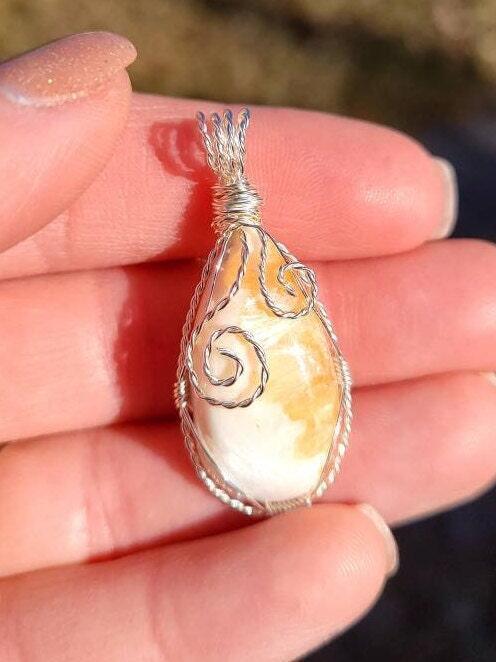
I want to click on pendant, so click(286, 392).